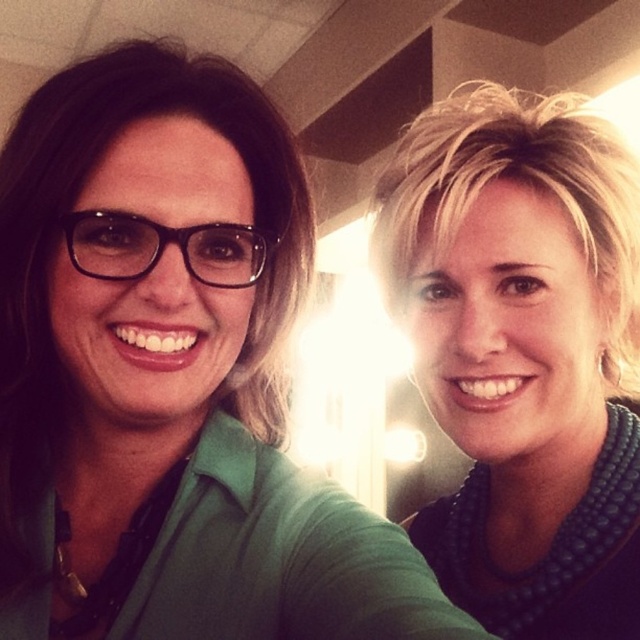
Question: Does teal beaded necklace at upper right have a smaller size compared to black plastic glasses at left?

Choices:
 (A) no
 (B) yes

Answer: (A)

Question: Among these objects, which one is nearest to the camera?

Choices:
 (A) black plastic glasses at left
 (B) teal beaded necklace at upper right

Answer: (A)

Question: Is teal beaded necklace at upper right smaller than black plastic glasses at left?

Choices:
 (A) yes
 (B) no

Answer: (B)

Question: Which of the following is the farthest from the observer?

Choices:
 (A) (224, 257)
 (B) (628, 461)

Answer: (B)

Question: Is teal beaded necklace at upper right thinner than black plastic glasses at left?

Choices:
 (A) no
 (B) yes

Answer: (A)